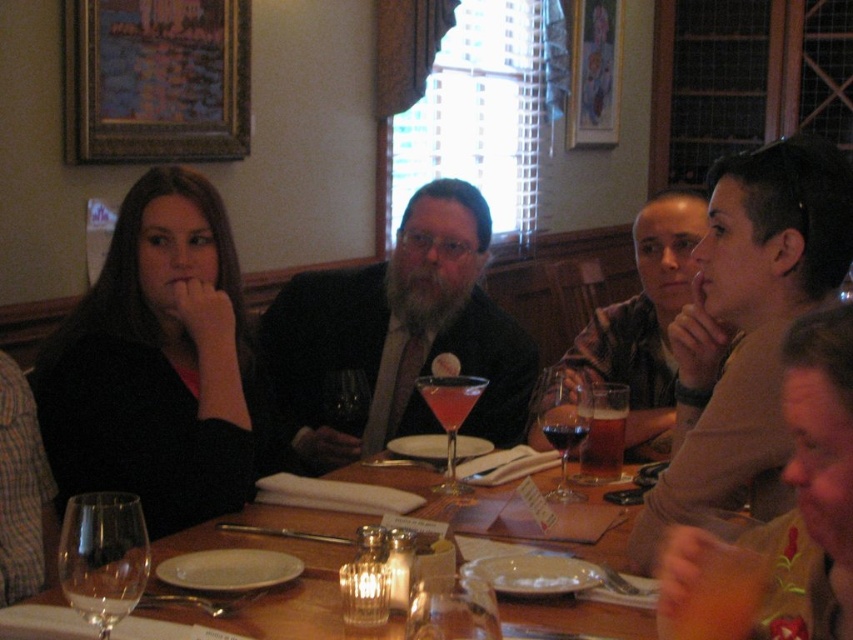
You are a waiter in a restaurant and need to place a new drink order. The customer points to an empty spot between the transparent glass at lower center and the clear glass wine at table center. Can you place the drink there without moving either glass?

The transparent glass at lower center is to the right of the clear glass wine at table center, so there is space between them where you can place the new drink order without moving either glass.

You are a waiter in a restaurant and need to place a new drink order for the customer. The existing drinks are located at point [608,442] and point [466,385]. Which point should you choose to place the new drink so it is closer to the customer?

You should place the new drink at point [608,442] because it is closer to the customer as it is further to the viewer compared to point [466,385].